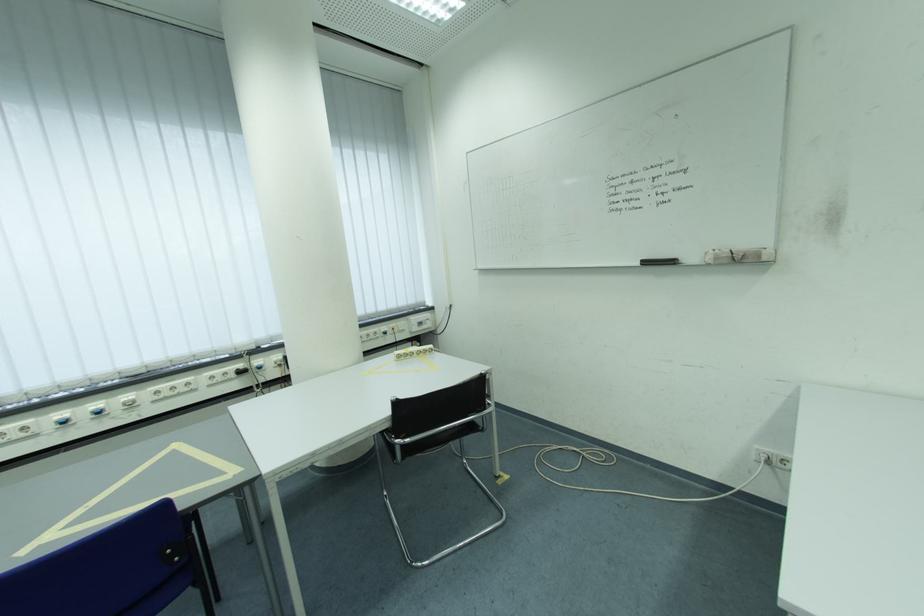
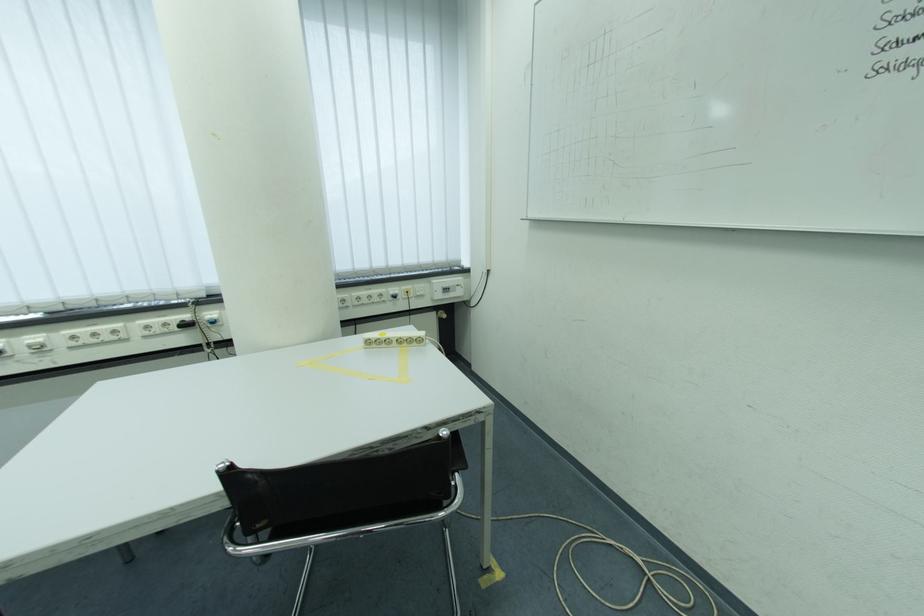
Where in the second image is the point corresponding to [140,400] from the first image?

(50, 342)